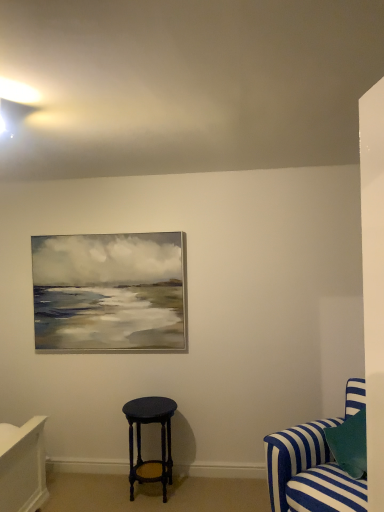
Question: Should I look upward or downward to see blue striped fabric couch at lower right?

Choices:
 (A) up
 (B) down

Answer: (B)

Question: From a real-world perspective, is matte dark blue stool at center physically below blue striped fabric couch at lower right?

Choices:
 (A) no
 (B) yes

Answer: (B)

Question: Is matte dark blue stool at center touching blue striped fabric couch at lower right?

Choices:
 (A) no
 (B) yes

Answer: (A)

Question: Considering the relative positions of matte dark blue stool at center and blue striped fabric couch at lower right in the image provided, is matte dark blue stool at center to the right of blue striped fabric couch at lower right from the viewer's perspective?

Choices:
 (A) yes
 (B) no

Answer: (B)

Question: Does matte dark blue stool at center have a smaller size compared to blue striped fabric couch at lower right?

Choices:
 (A) no
 (B) yes

Answer: (B)

Question: From the image's perspective, does matte dark blue stool at center appear higher than blue striped fabric couch at lower right?

Choices:
 (A) no
 (B) yes

Answer: (A)

Question: Is blue striped fabric couch at lower right a part of matte dark blue stool at center?

Choices:
 (A) yes
 (B) no

Answer: (B)

Question: Considering the relative sizes of blue striped fabric couch at lower right and matte dark blue stool at center in the image provided, is blue striped fabric couch at lower right shorter than matte dark blue stool at center?

Choices:
 (A) yes
 (B) no

Answer: (B)

Question: Considering the relative sizes of blue striped fabric couch at lower right and matte dark blue stool at center in the image provided, is blue striped fabric couch at lower right wider than matte dark blue stool at center?

Choices:
 (A) no
 (B) yes

Answer: (B)

Question: Does blue striped fabric couch at lower right have a greater height compared to matte dark blue stool at center?

Choices:
 (A) yes
 (B) no

Answer: (A)

Question: From a real-world perspective, is blue striped fabric couch at lower right over matte dark blue stool at center?

Choices:
 (A) yes
 (B) no

Answer: (A)

Question: Considering the relative sizes of blue striped fabric couch at lower right and matte dark blue stool at center in the image provided, is blue striped fabric couch at lower right bigger than matte dark blue stool at center?

Choices:
 (A) no
 (B) yes

Answer: (B)

Question: Is blue striped fabric couch at lower right turned away from matte dark blue stool at center?

Choices:
 (A) no
 (B) yes

Answer: (A)

Question: Is matte dark blue stool at center spatially inside blue striped fabric couch at lower right, or outside of it?

Choices:
 (A) outside
 (B) inside

Answer: (A)